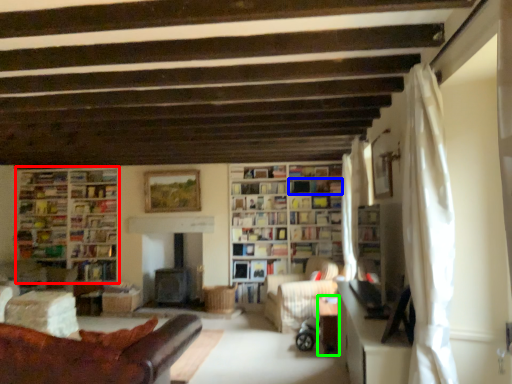
Question: Based on their relative distances, which object is farther from bookcase (highlighted by a red box)? Choose from shelf (highlighted by a blue box) and table (highlighted by a green box).

Choices:
 (A) shelf
 (B) table

Answer: (B)